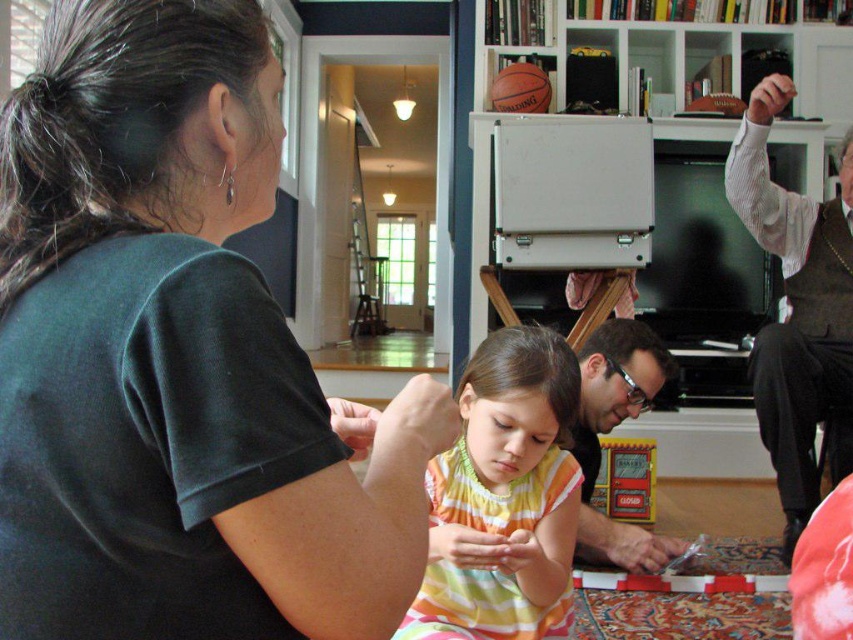
Can you confirm if black matte shirt at upper left is taller than yellow striped dress at center?

No, black matte shirt at upper left is not taller than yellow striped dress at center.

Is black matte shirt at upper left above yellow striped dress at center?

Yes.

Between point (122, 536) and point (532, 355), which one is positioned behind?

The point (532, 355) is behind.

Where is `black matte shirt at upper left`? This screenshot has height=640, width=853. black matte shirt at upper left is located at coordinates (177, 358).

Does striped shirt at right appear over matte black book at center?

Indeed, striped shirt at right is positioned over matte black book at center.

Does striped shirt at right have a larger size compared to matte black book at center?

Yes.

Measure the distance between point [770,365] and camera.

The distance of point [770,365] from camera is 2.48 meters.

Image resolution: width=853 pixels, height=640 pixels. Identify the location of striped shirt at right. (796, 307).

Which is in front, point (401, 532) or point (747, 182)?

Point (401, 532) is in front.

Does black matte shirt at upper left have a larger size compared to striped shirt at right?

Actually, black matte shirt at upper left might be smaller than striped shirt at right.

Image resolution: width=853 pixels, height=640 pixels. What do you see at coordinates (177, 358) in the screenshot?
I see `black matte shirt at upper left` at bounding box center [177, 358].

I want to click on black matte shirt at upper left, so click(177, 358).